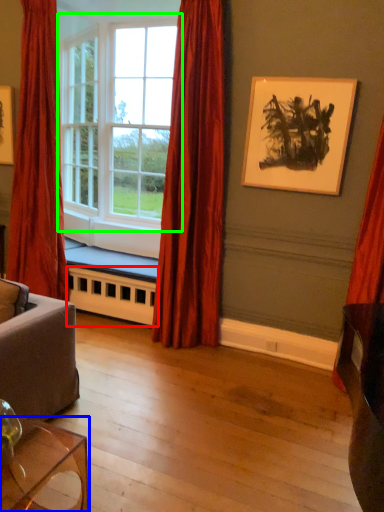
Question: Considering the real-world distances, which object is farthest from radiator (highlighted by a red box)? table (highlighted by a blue box) or window (highlighted by a green box)?

Choices:
 (A) table
 (B) window

Answer: (A)